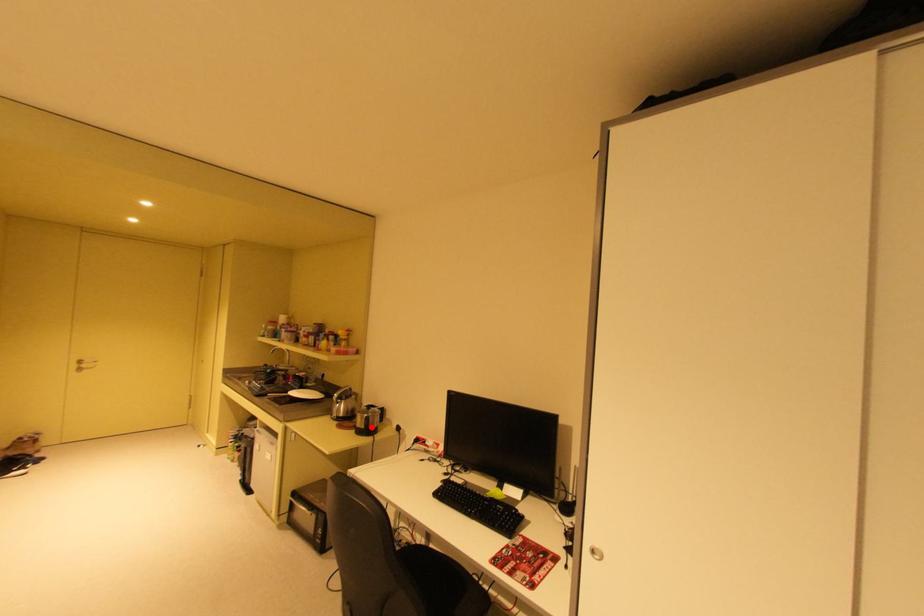
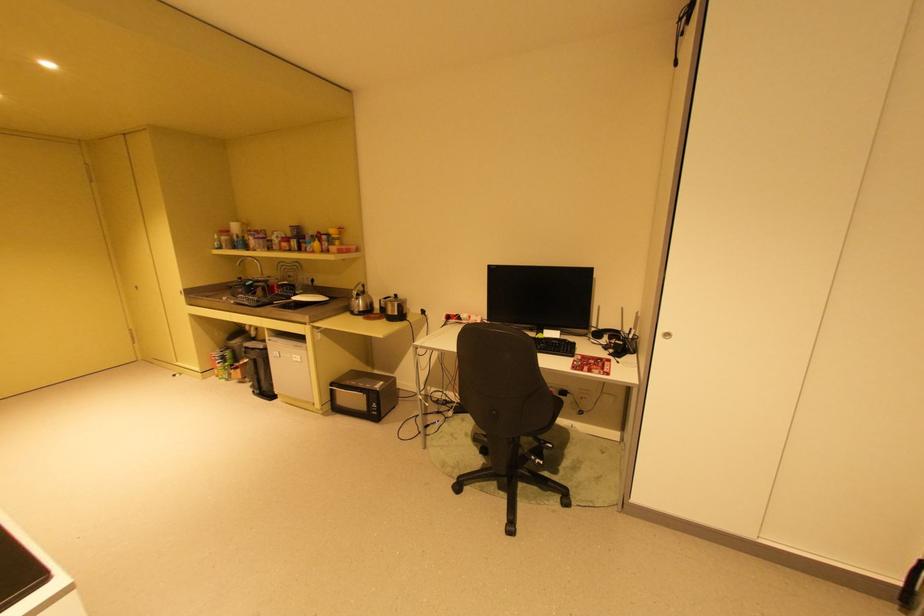
Where in the second image is the point corresponding to the highlighted location from the first image?

(404, 314)